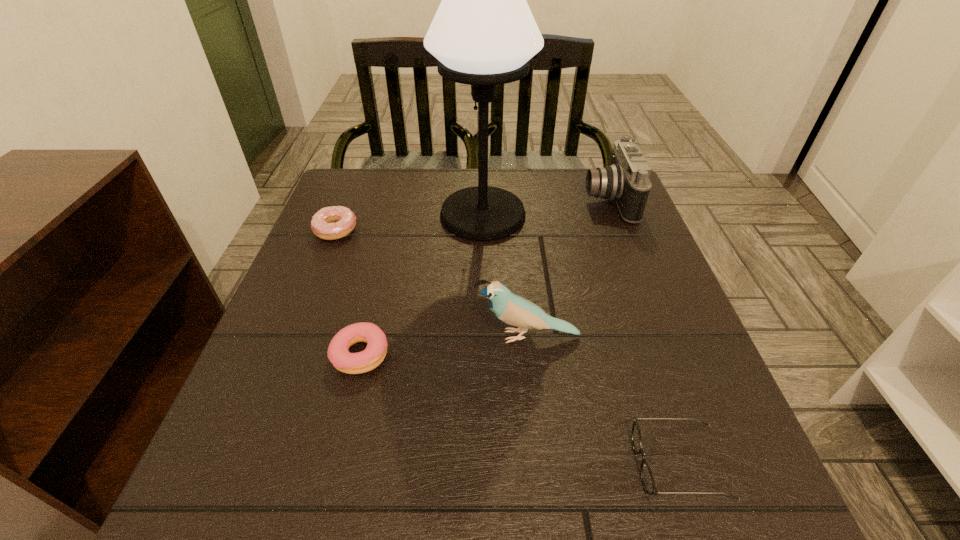
Locate an element on the screen. This screenshot has width=960, height=540. free region at the left edge of the desktop is located at coordinates click(332, 260).

Find the location of `vacant space at the right edge of the desktop`. vacant space at the right edge of the desktop is located at coordinates (582, 225).

Where is `vacant space at the far left corner of the desktop`? The height and width of the screenshot is (540, 960). vacant space at the far left corner of the desktop is located at coordinates (388, 192).

Locate an element on the screen. This screenshot has width=960, height=540. blank space at the near left corner of the desktop is located at coordinates (191, 501).

Locate an element on the screen. free space between the tallest object and the bird is located at coordinates (505, 275).

Identify the location of free spot between the bird and the farther doughnut. The image size is (960, 540). pos(431,283).

Identify the location of empty space between the table lamp and the nearer doughnut. (421, 285).

Where is `unoccupied area between the bird and the left doughnut`? This screenshot has width=960, height=540. unoccupied area between the bird and the left doughnut is located at coordinates (431, 283).

Where is `free point between the tallest object and the camera`? The height and width of the screenshot is (540, 960). free point between the tallest object and the camera is located at coordinates (545, 207).

Locate an element on the screen. Image resolution: width=960 pixels, height=540 pixels. vacant region between the spectacles and the camera is located at coordinates (643, 332).